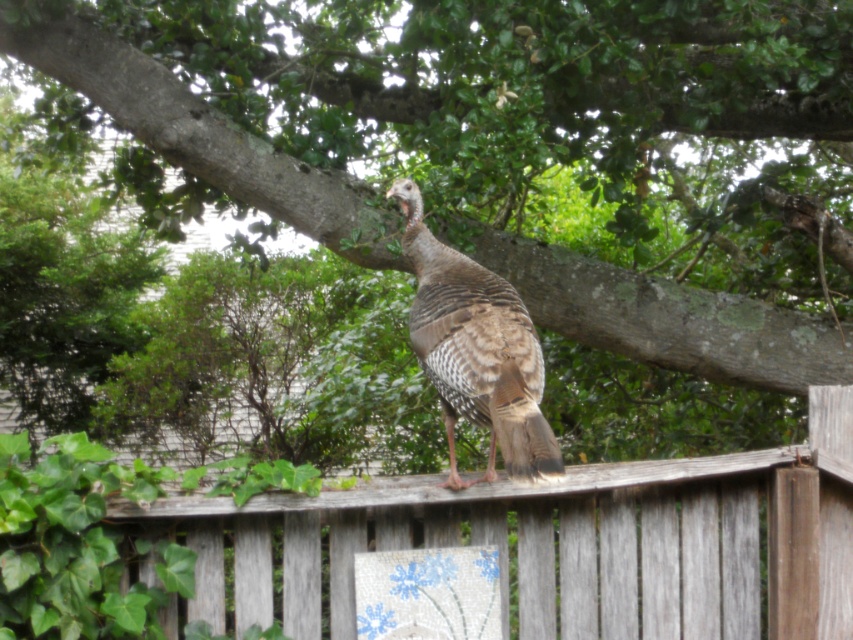
Question: Is weathered wood fence at upper center bigger than brown speckled feathers at center?

Choices:
 (A) no
 (B) yes

Answer: (B)

Question: Which point is closer to the camera?

Choices:
 (A) weathered wood fence at upper center
 (B) brown speckled feathers at center

Answer: (B)

Question: Which of the following is the closest to the observer?

Choices:
 (A) (192, 516)
 (B) (488, 403)

Answer: (B)

Question: Does weathered wood fence at upper center appear under brown speckled feathers at center?

Choices:
 (A) yes
 (B) no

Answer: (A)

Question: Can you confirm if weathered wood fence at upper center is positioned to the left of brown speckled feathers at center?

Choices:
 (A) no
 (B) yes

Answer: (A)